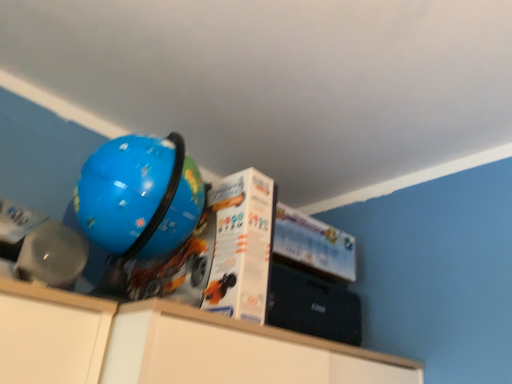
The width and height of the screenshot is (512, 384). What do you see at coordinates (241, 245) in the screenshot? I see `white matte cardboard box at upper center` at bounding box center [241, 245].

Where is `white matte cardboard box at upper center`? white matte cardboard box at upper center is located at coordinates (241, 245).

Image resolution: width=512 pixels, height=384 pixels. Identify the location of white matte cardboard box at upper center. point(241,245).